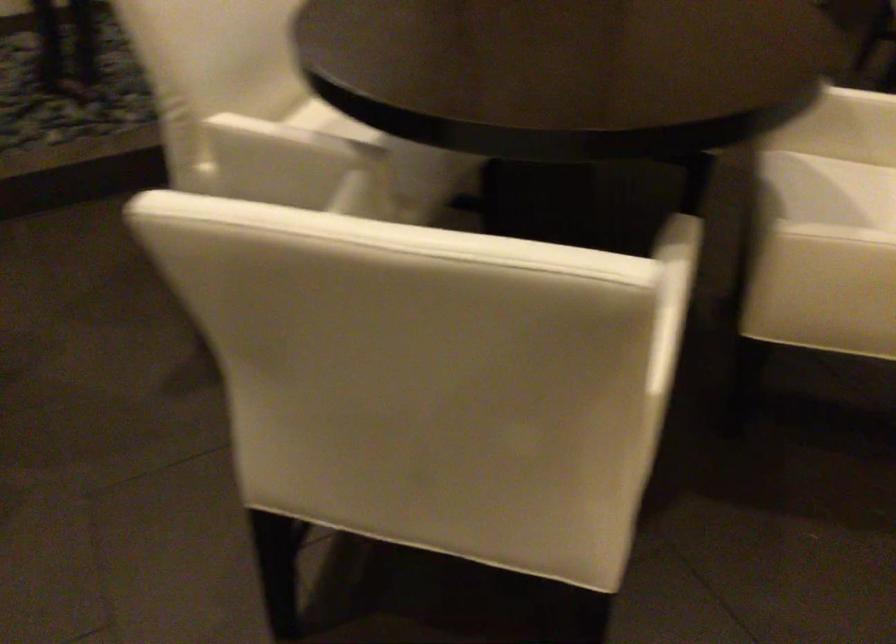
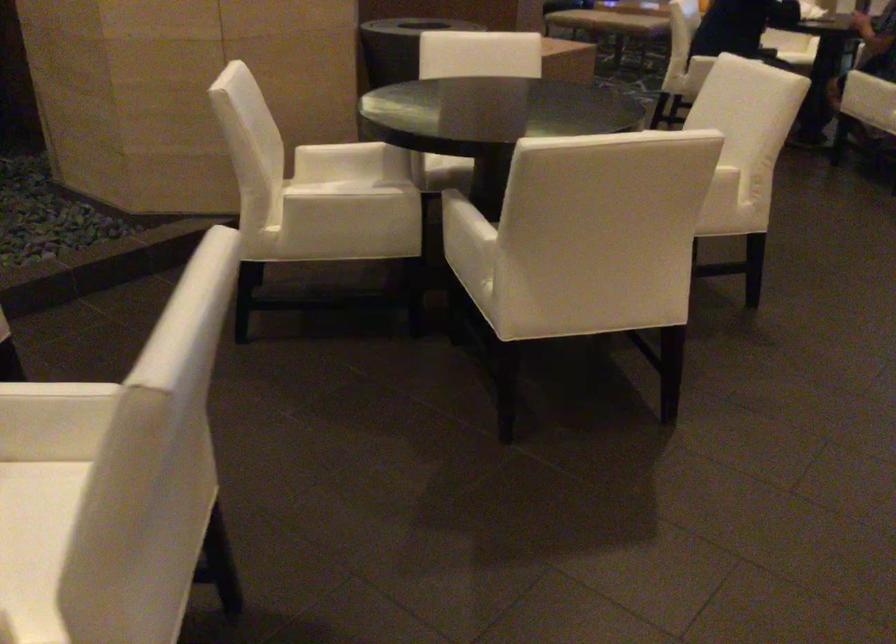
Question: In a continuous first-person perspective shot, in which direction is the camera moving?

Choices:
 (A) Left
 (B) Right
 (C) Forward
 (D) Backward

Answer: (B)